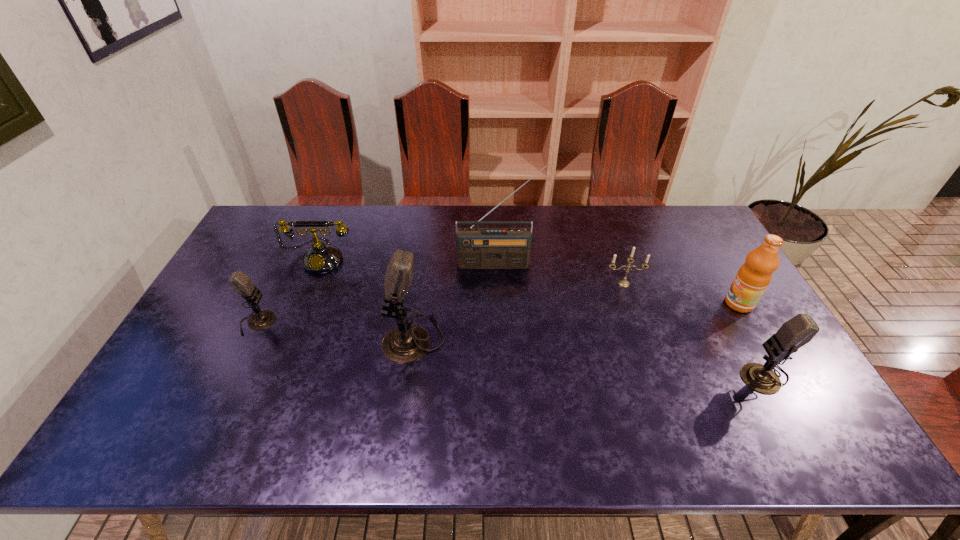
In order to click on vacant area situated 0.090m on the label side of the fruit juice in this screenshot , I will do `click(695, 303)`.

You are a GUI agent. You are given a task and a screenshot of the screen. Output one action in this format:
    pyautogui.click(x=<x>, y=<y>)
    Task: Click on the vacant space situated 0.120m on the label side of the fruit juice
    Image resolution: width=960 pixels, height=540 pixels.
    Given the screenshot: What is the action you would take?
    pyautogui.click(x=685, y=303)

Image resolution: width=960 pixels, height=540 pixels. What are the coordinates of `object located in the far edge section of the desktop` in the screenshot? It's located at (321, 258).

At what (x,y) coordinates should I click in order to perform the action: click on object located at the near edge. Please return your answer as a coordinate pair (x, y). Looking at the image, I should click on (798, 331).

What are the coordinates of `object at the left edge` in the screenshot? It's located at (241, 283).

What are the coordinates of `microphone that is at the right edge` in the screenshot? It's located at pyautogui.click(x=798, y=331).

This screenshot has width=960, height=540. What are the coordinates of `fruit juice that is positioned at the right edge` in the screenshot? It's located at (753, 277).

At what (x,y) coordinates should I click in order to perform the action: click on object that is positioned at the near right corner. Please return your answer as a coordinate pair (x, y). This screenshot has height=540, width=960. Looking at the image, I should click on (798, 331).

In the image, there is a desktop. At what (x,y) coordinates should I click in order to perform the action: click on vacant space at the far edge. Please return your answer as a coordinate pair (x, y). Looking at the image, I should click on (543, 209).

Identify the location of vacant space at the near edge of the desktop. (719, 388).